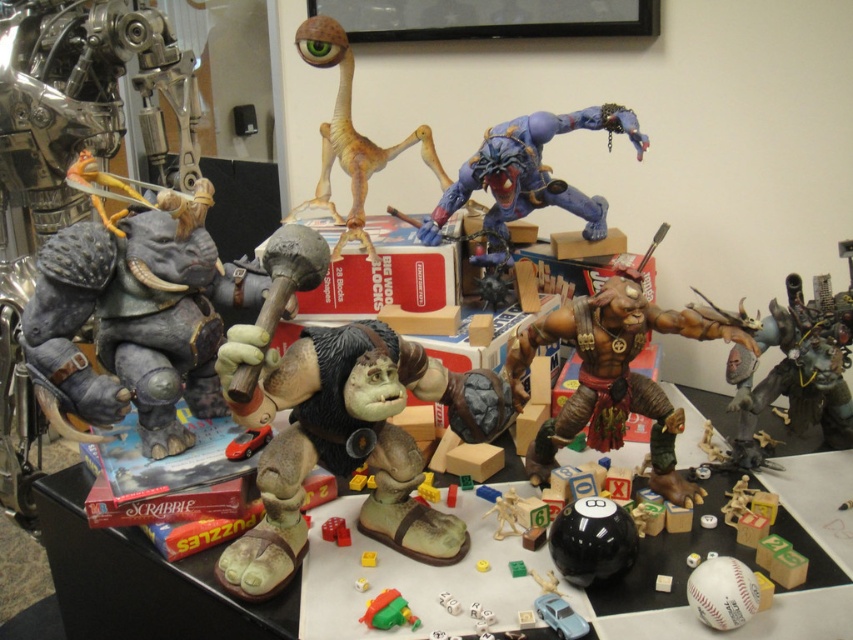
Question: Among these objects, which one is nearest to the camera?

Choices:
 (A) light blue plastic toy car at center
 (B) brown leather figurine at center
 (C) white matte baseball at lower right

Answer: (C)

Question: Which is nearer to the blue matte figure at upper right?

Choices:
 (A) rubberized green and red toy at center
 (B) smooth brown wooden table at center

Answer: (A)

Question: Does brown leather figurine at center appear under matte brown dice at center?

Choices:
 (A) yes
 (B) no

Answer: (B)

Question: Which of the following is the closest to the observer?

Choices:
 (A) (718, 589)
 (B) (322, 531)

Answer: (A)

Question: Can you confirm if brown matte alien at center is smaller than white matte baseball at lower right?

Choices:
 (A) yes
 (B) no

Answer: (B)

Question: In this image, where is smooth brown wooden table at center located relative to light blue plastic toy car at center?

Choices:
 (A) left
 (B) right

Answer: (A)